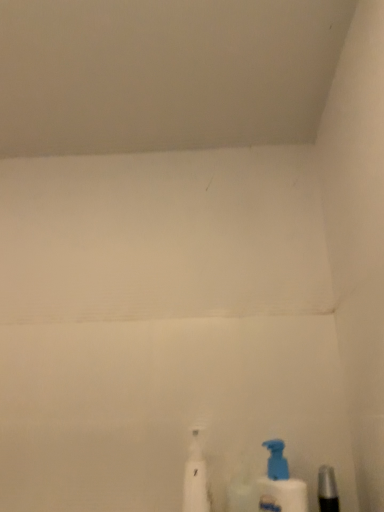
Question: Is blue plastic bottle at lower right smaller than white plastic spray bottle at lower center?

Choices:
 (A) no
 (B) yes

Answer: (B)

Question: Is blue plastic bottle at lower right positioned before white plastic spray bottle at lower center?

Choices:
 (A) yes
 (B) no

Answer: (A)

Question: Is white plastic spray bottle at lower center a part of blue plastic bottle at lower right?

Choices:
 (A) no
 (B) yes

Answer: (A)

Question: Considering the relative positions of blue plastic bottle at lower right and white plastic spray bottle at lower center in the image provided, is blue plastic bottle at lower right to the right of white plastic spray bottle at lower center from the viewer's perspective?

Choices:
 (A) yes
 (B) no

Answer: (A)

Question: Considering the relative positions of blue plastic bottle at lower right and white plastic spray bottle at lower center in the image provided, is blue plastic bottle at lower right behind white plastic spray bottle at lower center?

Choices:
 (A) yes
 (B) no

Answer: (B)

Question: Considering the relative sizes of blue plastic bottle at lower right and white plastic spray bottle at lower center in the image provided, is blue plastic bottle at lower right taller than white plastic spray bottle at lower center?

Choices:
 (A) yes
 (B) no

Answer: (B)

Question: From a real-world perspective, is metallic silver razor at lower right under white plastic spray bottle at lower center?

Choices:
 (A) yes
 (B) no

Answer: (A)

Question: Can you confirm if metallic silver razor at lower right is shorter than white plastic spray bottle at lower center?

Choices:
 (A) no
 (B) yes

Answer: (B)

Question: Does metallic silver razor at lower right have a greater width compared to white plastic spray bottle at lower center?

Choices:
 (A) no
 (B) yes

Answer: (A)

Question: Considering the relative sizes of metallic silver razor at lower right and white plastic spray bottle at lower center in the image provided, is metallic silver razor at lower right smaller than white plastic spray bottle at lower center?

Choices:
 (A) yes
 (B) no

Answer: (A)

Question: Is metallic silver razor at lower right oriented away from white plastic spray bottle at lower center?

Choices:
 (A) yes
 (B) no

Answer: (B)

Question: Is metallic silver razor at lower right closer to camera compared to white plastic spray bottle at lower center?

Choices:
 (A) no
 (B) yes

Answer: (B)

Question: Is metallic silver razor at lower right positioned far away from blue plastic bottle at lower right?

Choices:
 (A) yes
 (B) no

Answer: (B)